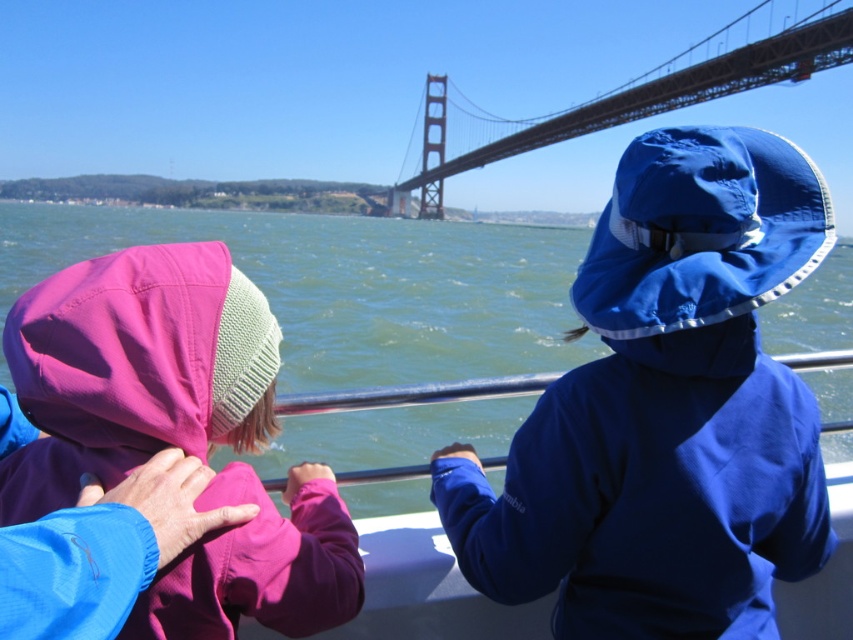
Question: Which object is positioned closest to the metallic bridge at upper center?

Choices:
 (A) pink fabric hood at left
 (B) blue matte sun hat at upper right
 (C) green water at center

Answer: (C)

Question: Estimate the real-world distances between objects in this image. Which object is farther from the pink fabric hood at left?

Choices:
 (A) green water at center
 (B) metallic bridge at upper center

Answer: (B)

Question: Estimate the real-world distances between objects in this image. Which object is farther from the green water at center?

Choices:
 (A) metallic bridge at upper center
 (B) pink fabric hood at left
 (C) blue matte sun hat at upper right

Answer: (A)

Question: Can you confirm if green water at center is positioned to the right of metallic bridge at upper center?

Choices:
 (A) no
 (B) yes

Answer: (A)

Question: Is blue matte sun hat at upper right above metallic bridge at upper center?

Choices:
 (A) yes
 (B) no

Answer: (B)

Question: Is green water at center below pink fabric hood at left?

Choices:
 (A) no
 (B) yes

Answer: (A)